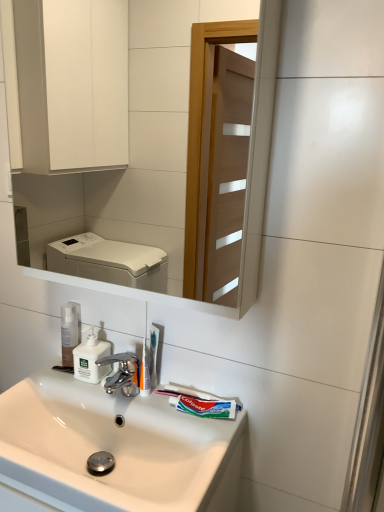
This screenshot has width=384, height=512. In order to click on vacant space in white glossy mirror at upper center (from a real-world perspective) in this screenshot , I will do `click(135, 400)`.